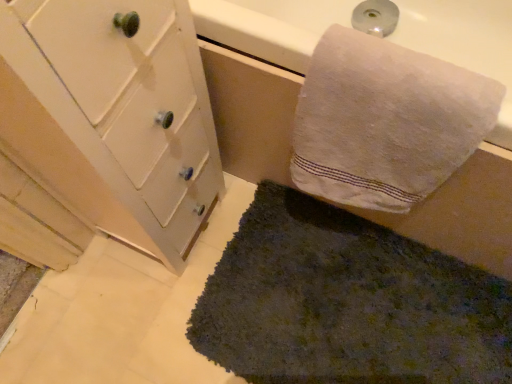
Question: Does white painted wood cabinet at left have a greater width compared to dark green shaggy rug at lower center?

Choices:
 (A) no
 (B) yes

Answer: (A)

Question: Does white painted wood cabinet at left turn towards dark green shaggy rug at lower center?

Choices:
 (A) yes
 (B) no

Answer: (A)

Question: From the image's perspective, is white painted wood cabinet at left under dark green shaggy rug at lower center?

Choices:
 (A) no
 (B) yes

Answer: (A)

Question: Considering the relative sizes of white painted wood cabinet at left and dark green shaggy rug at lower center in the image provided, is white painted wood cabinet at left bigger than dark green shaggy rug at lower center?

Choices:
 (A) yes
 (B) no

Answer: (A)

Question: Is the position of white painted wood cabinet at left more distant than that of dark green shaggy rug at lower center?

Choices:
 (A) yes
 (B) no

Answer: (B)

Question: Considering the relative sizes of white painted wood cabinet at left and dark green shaggy rug at lower center in the image provided, is white painted wood cabinet at left smaller than dark green shaggy rug at lower center?

Choices:
 (A) yes
 (B) no

Answer: (B)

Question: Is white cotton towel at upper right behind white painted wood cabinet at left?

Choices:
 (A) no
 (B) yes

Answer: (B)

Question: Considering the relative sizes of white cotton towel at upper right and white painted wood cabinet at left in the image provided, is white cotton towel at upper right smaller than white painted wood cabinet at left?

Choices:
 (A) yes
 (B) no

Answer: (A)

Question: From a real-world perspective, is white cotton towel at upper right under white painted wood cabinet at left?

Choices:
 (A) yes
 (B) no

Answer: (B)

Question: Does white cotton towel at upper right have a greater width compared to white painted wood cabinet at left?

Choices:
 (A) no
 (B) yes

Answer: (A)

Question: Is white cotton towel at upper right closer to the viewer compared to white painted wood cabinet at left?

Choices:
 (A) no
 (B) yes

Answer: (A)

Question: Can we say white cotton towel at upper right lies outside white painted wood cabinet at left?

Choices:
 (A) yes
 (B) no

Answer: (A)

Question: Is dark green shaggy rug at lower center in front of white cotton towel at upper right?

Choices:
 (A) no
 (B) yes

Answer: (A)